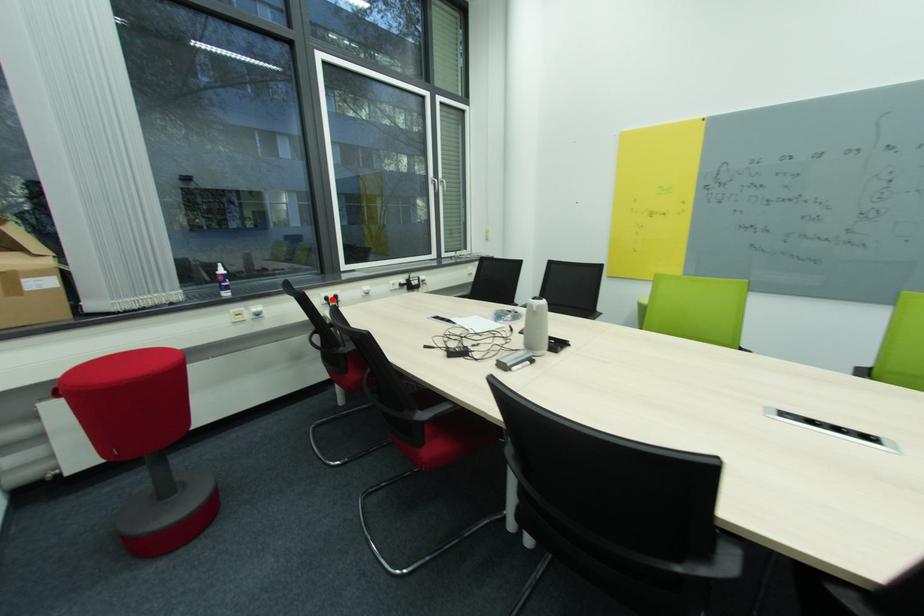
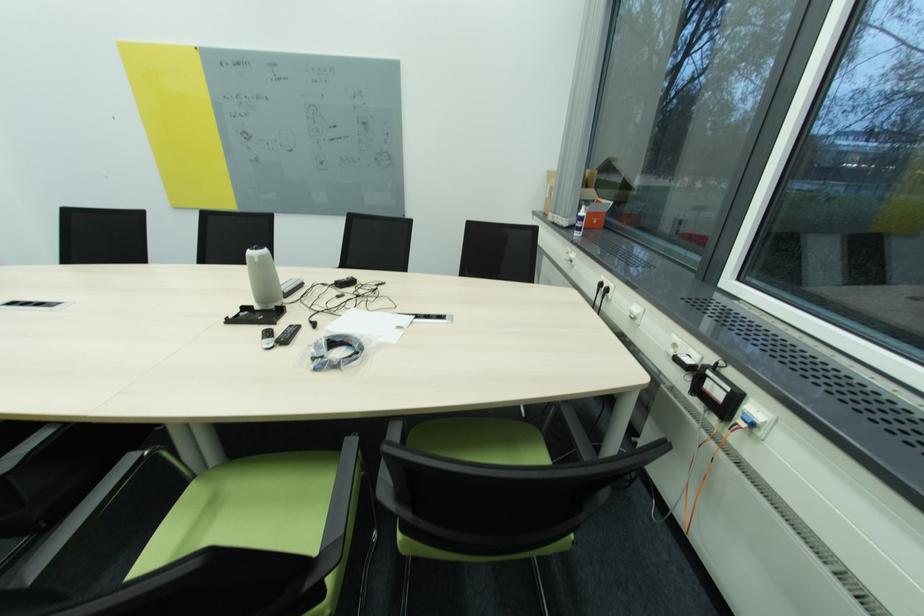
Question: A red point is marked in image1. In image2, is the corresponding 3D point closer to the camera or farther? Reply with the corresponding letter.

Choices:
 (A) The corresponding 3D point is closer.
 (B) The corresponding 3D point is farther.

Answer: (A)